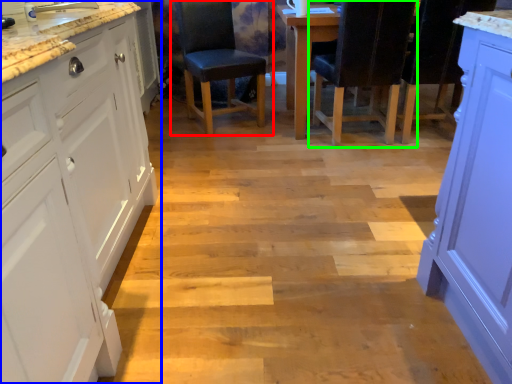
Question: Considering the real-world distances, which object is closest to chair (highlighted by a red box)? cabinetry (highlighted by a blue box) or chair (highlighted by a green box).

Choices:
 (A) cabinetry
 (B) chair

Answer: (B)